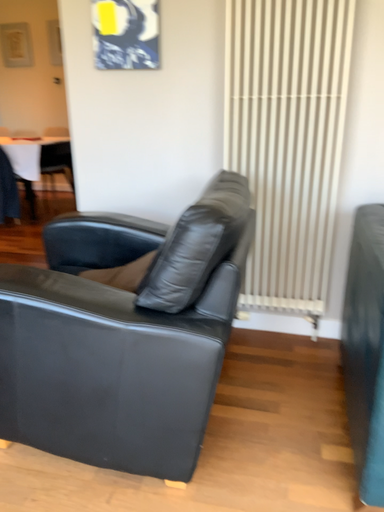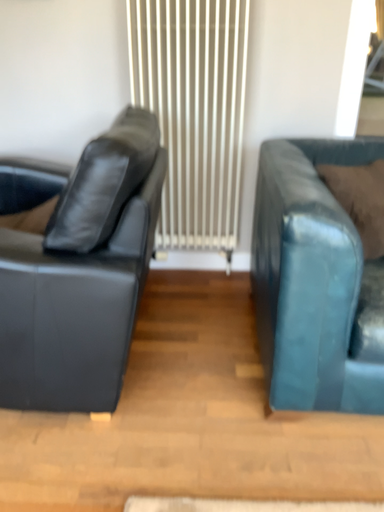
Question: Which way did the camera rotate in the video?

Choices:
 (A) rotated upward
 (B) rotated downward

Answer: (B)